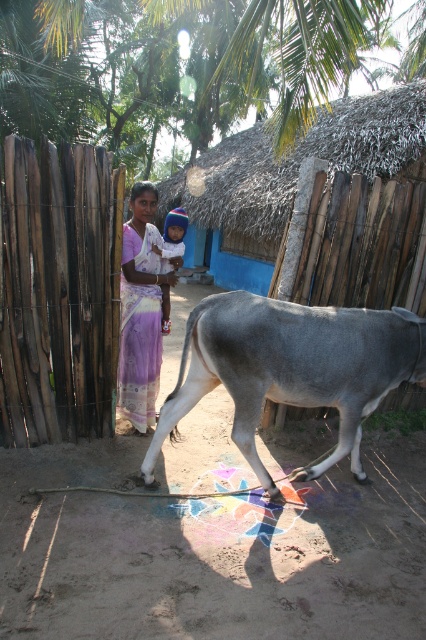
You are standing at the origin point in the image. Where is the gray matte cow at center located in terms of coordinates?

The gray matte cow at center is located at point coordinates of (290, 369).

What is the exact coordinate of the gray matte cow at center in the image?

The gray matte cow at center is located at point (290, 369).